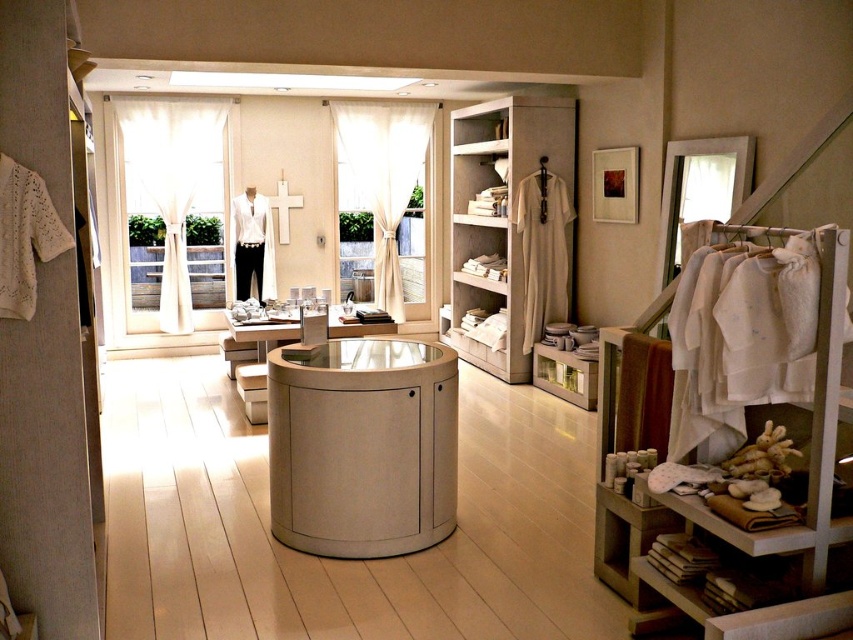
Does beige fabric shelf at center right appear on the right side of matte white vanity at center?

Correct, you'll find beige fabric shelf at center right to the right of matte white vanity at center.

Which is below, beige fabric shelf at center right or matte white vanity at center?

matte white vanity at center is lower down.

This screenshot has height=640, width=853. What do you see at coordinates (500, 212) in the screenshot?
I see `beige fabric shelf at center right` at bounding box center [500, 212].

Locate an element on the screen. beige fabric shelf at center right is located at coordinates (500, 212).

Is light beige fabric robe at center closer to camera compared to white matte shirt at center?

Yes.

Between point (552, 188) and point (236, 208), which one is positioned in front?

Positioned in front is point (552, 188).

Locate an element on the screen. Image resolution: width=853 pixels, height=640 pixels. light beige fabric robe at center is located at coordinates (543, 250).

Looking at this image, does light beige fabric robe at center appear under matte white vanity at center?

No.

Consider the image. Can you confirm if light beige fabric robe at center is taller than matte white vanity at center?

Yes.

Between point (561, 269) and point (297, 317), which one is positioned behind?

Positioned behind is point (561, 269).

Locate an element on the screen. This screenshot has height=640, width=853. light beige fabric robe at center is located at coordinates (543, 250).